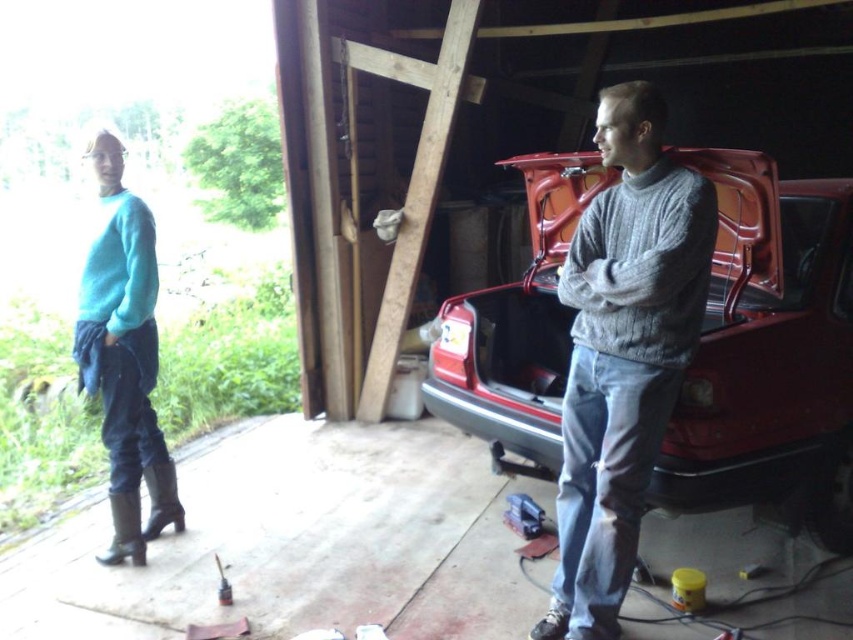
Question: Based on their relative distances, which object is farther from the teal sweater at left?

Choices:
 (A) gray knitted sweater at center
 (B) matte red car at center

Answer: (B)

Question: From the image, what is the correct spatial relationship of gray knitted sweater at center in relation to teal sweater at left?

Choices:
 (A) below
 (B) above

Answer: (A)

Question: Is the position of gray knitted sweater at center less distant than that of teal sweater at left?

Choices:
 (A) yes
 (B) no

Answer: (A)

Question: Does matte red car at center come behind teal sweater at left?

Choices:
 (A) yes
 (B) no

Answer: (B)

Question: Which of these objects is positioned farthest from the gray knitted sweater at center?

Choices:
 (A) teal sweater at left
 (B) matte red car at center

Answer: (A)

Question: Among these objects, which one is nearest to the camera?

Choices:
 (A) gray knitted sweater at center
 (B) teal sweater at left
 (C) matte red car at center

Answer: (A)